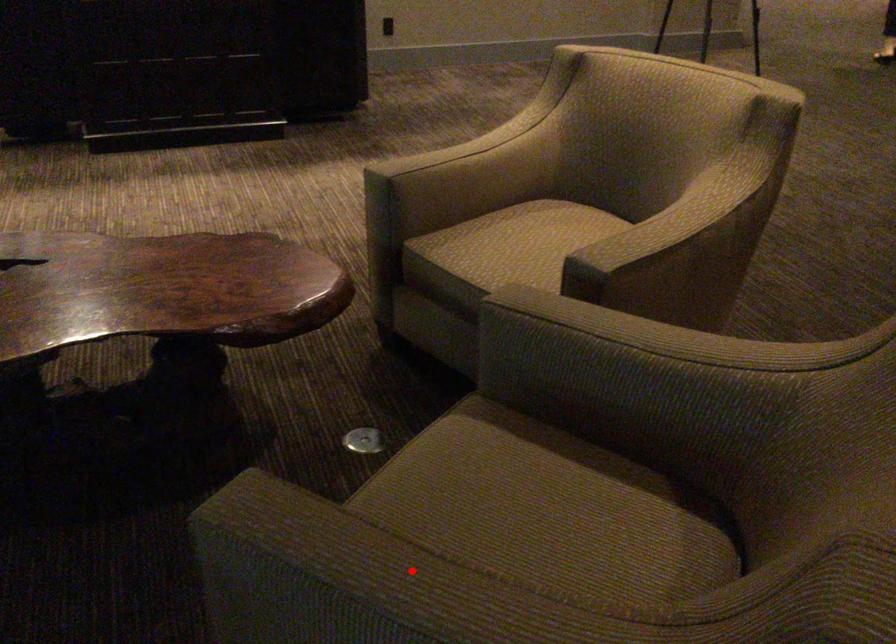
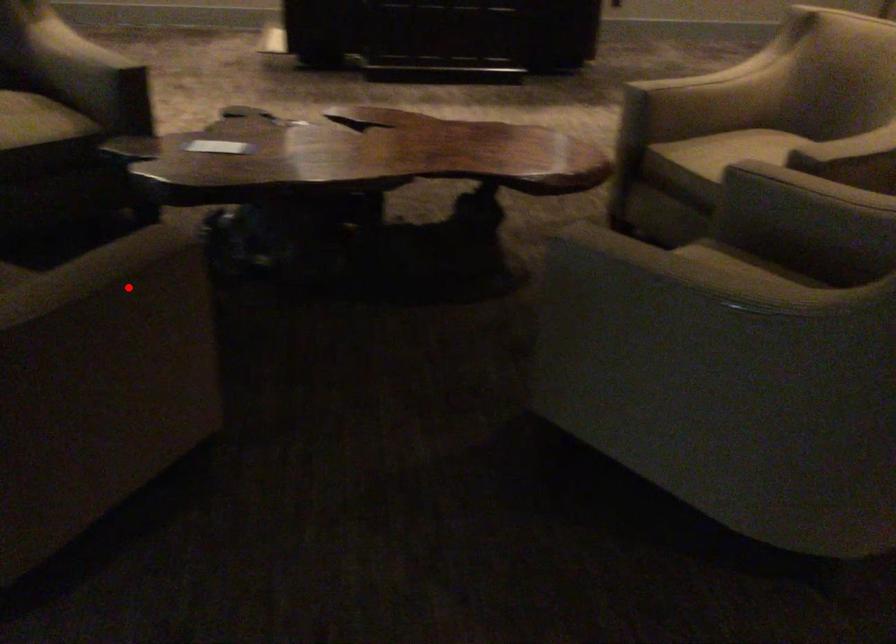
I am providing you with two images of the same scene from different viewpoints. A red point is marked on the first image and another point is marked on the second image. Do the highlighted points in image1 and image2 indicate the same real-world spot?

No